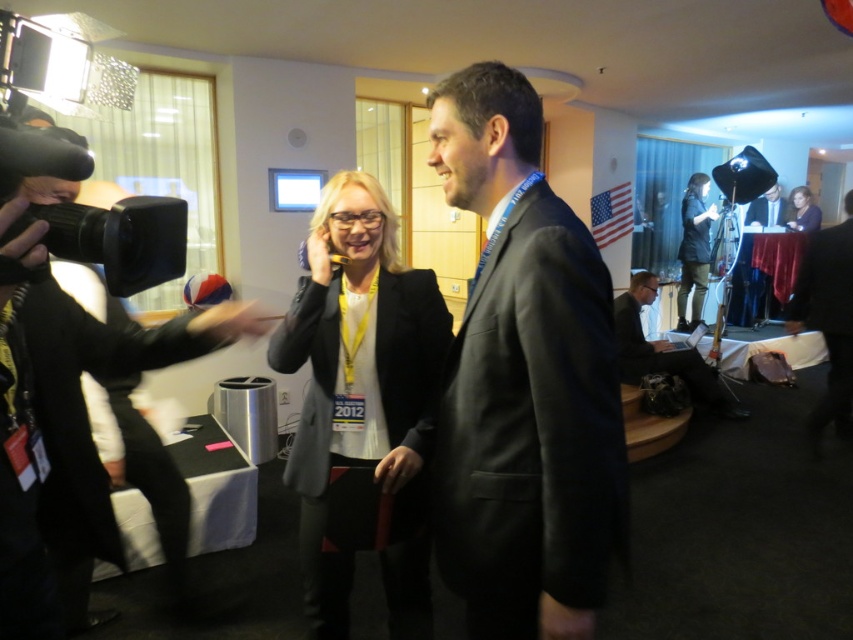
Question: Which object is closer to the camera taking this photo?

Choices:
 (A) matte black suit at center
 (B) dark suit at center

Answer: (A)

Question: Does black fabric hat at right lie in front of matte black jacket at upper right?

Choices:
 (A) no
 (B) yes

Answer: (B)

Question: Estimate the real-world distances between objects in this image. Which object is farther from the matte black laptop at lower right?

Choices:
 (A) matte black jacket at upper right
 (B) dark suit at center

Answer: (B)

Question: Among these points, which one is farthest from the camera?

Choices:
 (A) (683, 282)
 (B) (633, 371)
 (C) (813, 209)
 (D) (357, 321)

Answer: (C)

Question: Where is matte black blazer at center located in relation to matte black laptop at lower right in the image?

Choices:
 (A) left
 (B) right

Answer: (A)

Question: Can you confirm if matte black suit at center is smaller than black matte suit at left?

Choices:
 (A) yes
 (B) no

Answer: (A)